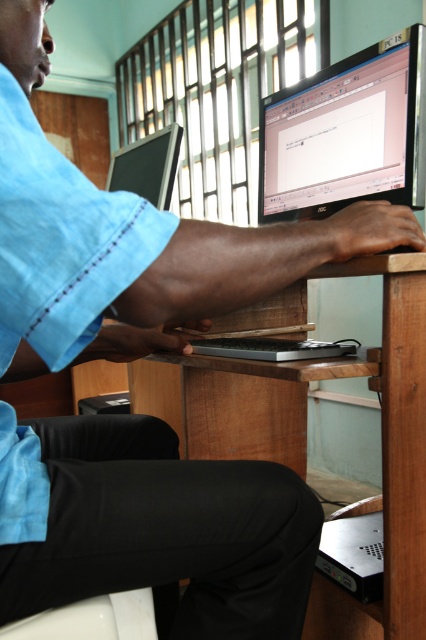
Is matte black monitor at upper center taller than matte black monitor at center?

Yes, matte black monitor at upper center is taller than matte black monitor at center.

Is point (333, 125) farther from viewer compared to point (138, 163)?

No, (333, 125) is closer to viewer.

Locate an element on the screen. The image size is (426, 640). matte black monitor at upper center is located at coordinates (347, 132).

Who is positioned more to the right, matte black monitor at upper center or silver metallic laptop at center?

Positioned to the right is matte black monitor at upper center.

Image resolution: width=426 pixels, height=640 pixels. I want to click on matte black monitor at upper center, so click(347, 132).

This screenshot has width=426, height=640. I want to click on matte black monitor at upper center, so click(x=347, y=132).

Is satin black computer at lower right further to the viewer compared to matte black monitor at center?

No, satin black computer at lower right is in front of matte black monitor at center.

Who is higher up, satin black computer at lower right or matte black monitor at center?

matte black monitor at center

Find the location of a particular element. This screenshot has height=640, width=426. satin black computer at lower right is located at coordinates (354, 554).